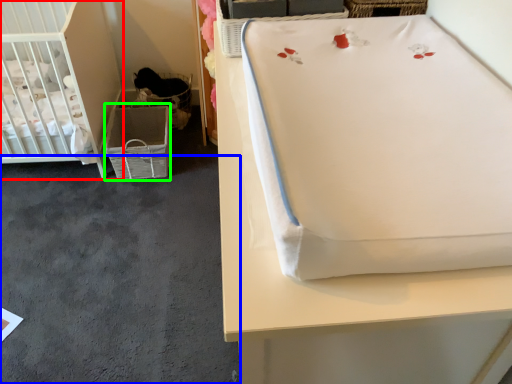
Question: Which object is the farthest from infant bed (highlighted by a red box)? Choose among these: concrete (highlighted by a blue box) or crate (highlighted by a green box).

Choices:
 (A) concrete
 (B) crate

Answer: (A)